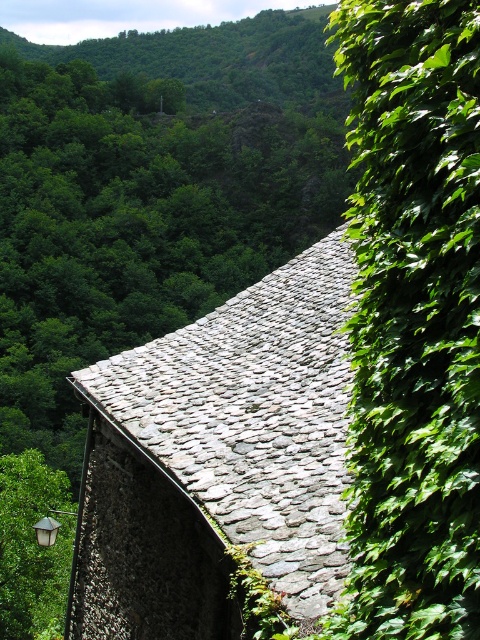
Who is positioned more to the right, green leafy ivy at right or green leafy tree at lower left?

Positioned to the right is green leafy ivy at right.

Does green leafy ivy at right have a lesser height compared to green leafy tree at lower left?

Yes.

Is point (468, 627) farther from camera compared to point (36, 465)?

That is False.

Identify the location of green leafy ivy at right. This screenshot has height=640, width=480. (412, 320).

From the picture: Is gray stone roof at upper center further to camera compared to green leafy tree at lower left?

That is False.

Who is taller, gray stone roof at upper center or green leafy tree at lower left?

Standing taller between the two is gray stone roof at upper center.

What do you see at coordinates (219, 458) in the screenshot?
I see `gray stone roof at upper center` at bounding box center [219, 458].

Identify the location of gray stone roof at upper center. Image resolution: width=480 pixels, height=640 pixels. (219, 458).

Is green leafy ivy at right bigger than gray stone roof at upper center?

Incorrect, green leafy ivy at right is not larger than gray stone roof at upper center.

Is point (389, 182) closer to camera compared to point (139, 532)?

Yes, it is.

Who is more forward, [374,449] or [326,524]?

Positioned in front is point [374,449].

Identify the location of green leafy ivy at right. (412, 320).